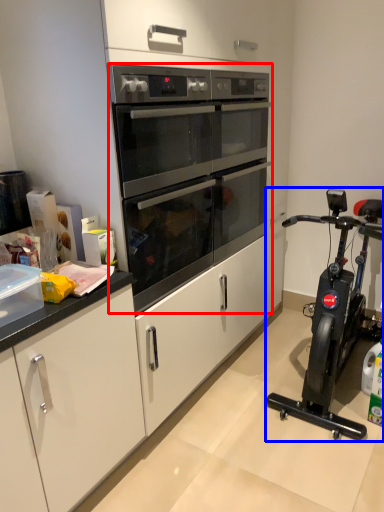
Question: Which of the following is the farthest to the observer, oven (highlighted by a red box) or home appliance (highlighted by a blue box)?

Choices:
 (A) oven
 (B) home appliance

Answer: (A)